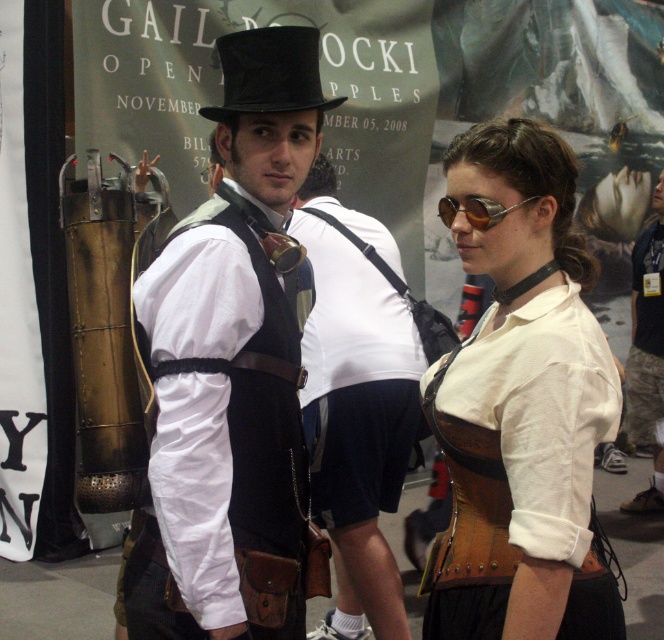
You are organizing a cosplay event and need to ensure that all participants can move comfortably in their costumes. You notice two key elements on a participant wearing a steampunk costume. The first is the matte black vest at center, and the second is the brushed metal tank at center. Which of these two items takes up more space on the participant?

The brushed metal tank at center takes up more space than the matte black vest at center, as the matte black vest at center occupies less space than the brushed metal tank at center.

In the scene shown: You are a photographer at the event. You want to take a photo of the gold metallic goggles at center and the brushed metal tank at center so that both are clearly visible. However, the goggles are currently partially hidden. What should you do to ensure both objects are fully visible in the photo?

The gold metallic goggles at center is behind the brushed metal tank at center. To ensure both are visible, move the camera angle so that the goggles are no longer obscured by the tank, perhaps by shifting the perspective to the side or adjusting the position of the objects.

Consider the image. You are a photographer at the event and need to capture a clear shot of both the brushed metal tank at center and the gold metallic goggles at center. Since the camera can only focus on one object at a time, which object should you focus on first to ensure the other is still in the frame?

The brushed metal tank at center is located below the gold metallic goggles at center, so focusing on the gold metallic goggles at center first would allow the lower positioned brushed metal tank at center to still be in the frame.